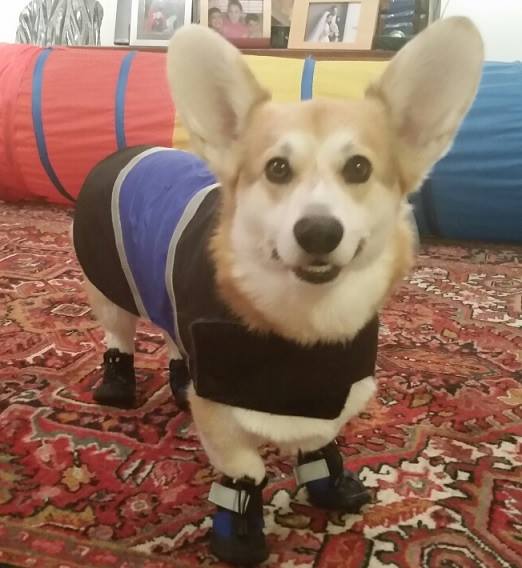
You are a GUI agent. You are given a task and a screenshot of the screen. Output one action in this format:
    pyautogui.click(x=<x>, y=<y>)
    Task: Click on the phone
    
    Given the screenshot: What is the action you would take?
    pyautogui.click(x=270, y=374)